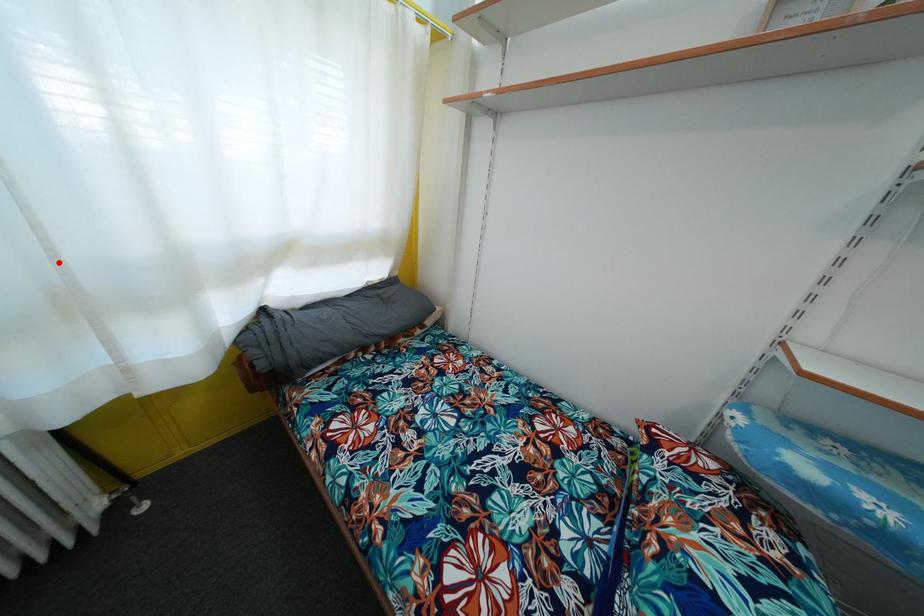
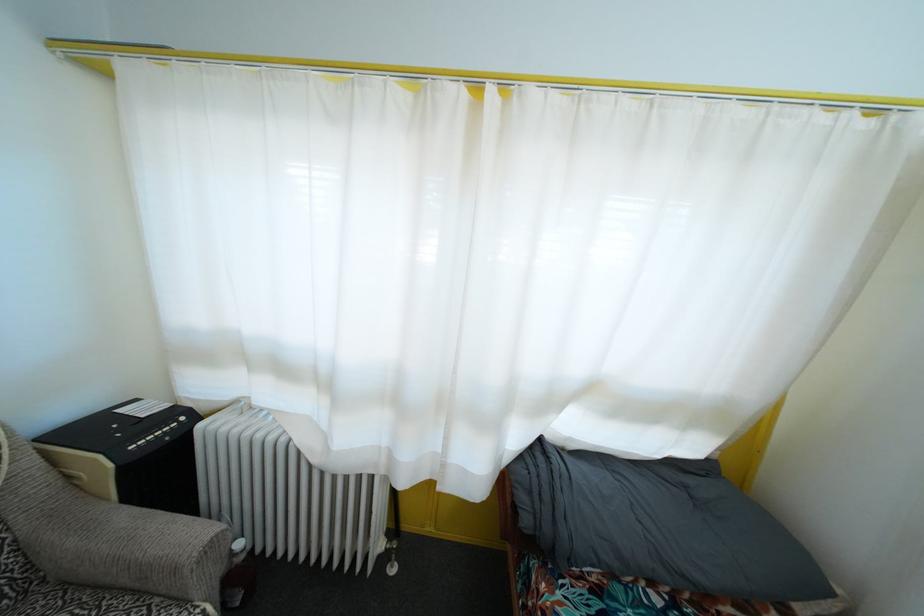
Where in the second image is the point corresponding to the highlighted location from the first image?

(457, 379)